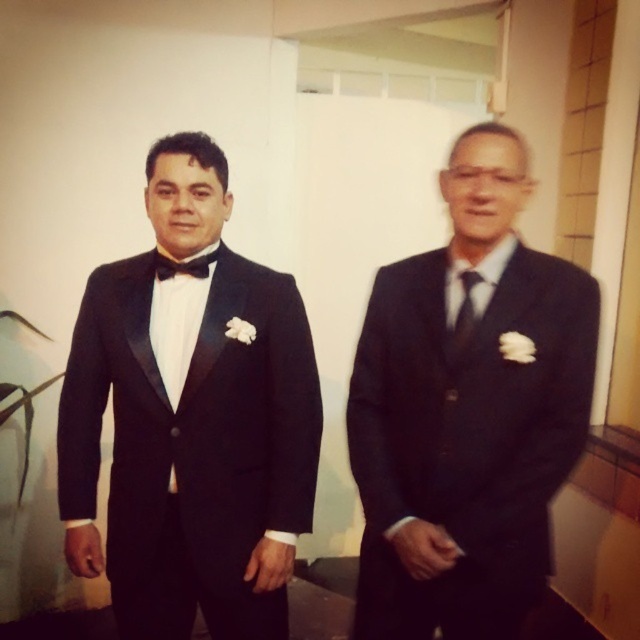
Based on the scene description, which object is taller between the matte black tuxedo at left and the satin black tie at center?

The matte black tuxedo at left is much taller than the satin black tie at center.